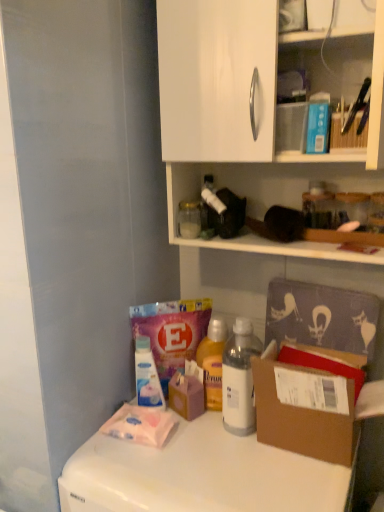
The image size is (384, 512). I want to click on vacant area on top of white glossy counter top at lower left (from a real-world perspective), so click(206, 459).